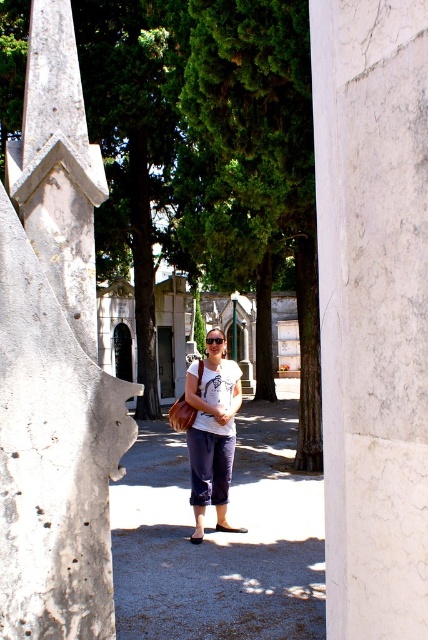
Question: Which object is positioned closest to the denim pants at center?

Choices:
 (A) white marble pillar at center
 (B) white cotton t-shirt at center

Answer: (B)

Question: Can you confirm if white marble pillar at center is positioned to the right of white cotton t-shirt at center?

Choices:
 (A) yes
 (B) no

Answer: (A)

Question: Does white marble pillar at center have a smaller size compared to denim pants at center?

Choices:
 (A) no
 (B) yes

Answer: (B)

Question: Where is white marble pillar at center located in relation to denim pants at center in the image?

Choices:
 (A) above
 (B) below

Answer: (A)

Question: Which of the following is the farthest from the observer?

Choices:
 (A) (162, 548)
 (B) (228, 445)
 (C) (359, 282)

Answer: (B)

Question: Which point is farther from the camera taking this photo?

Choices:
 (A) (386, 8)
 (B) (223, 512)

Answer: (B)